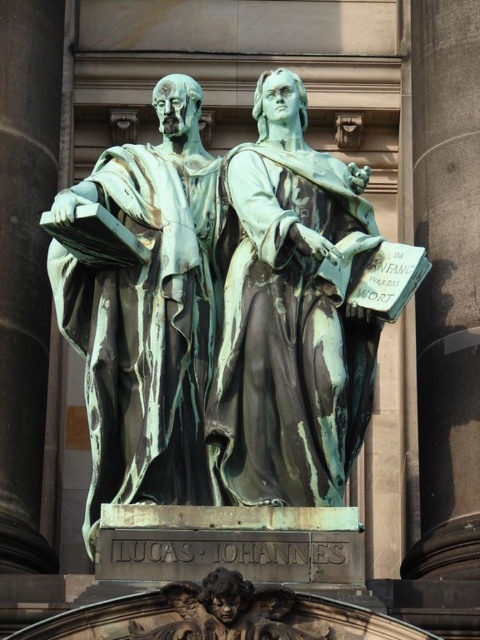
Who is more distant from viewer, (310, 209) or (135, 449)?

The point (310, 209) is behind.

Who is positioned more to the right, bronze statue at center or green patina statue at left?

Positioned to the right is bronze statue at center.

Identify the location of bronze statue at center. (290, 316).